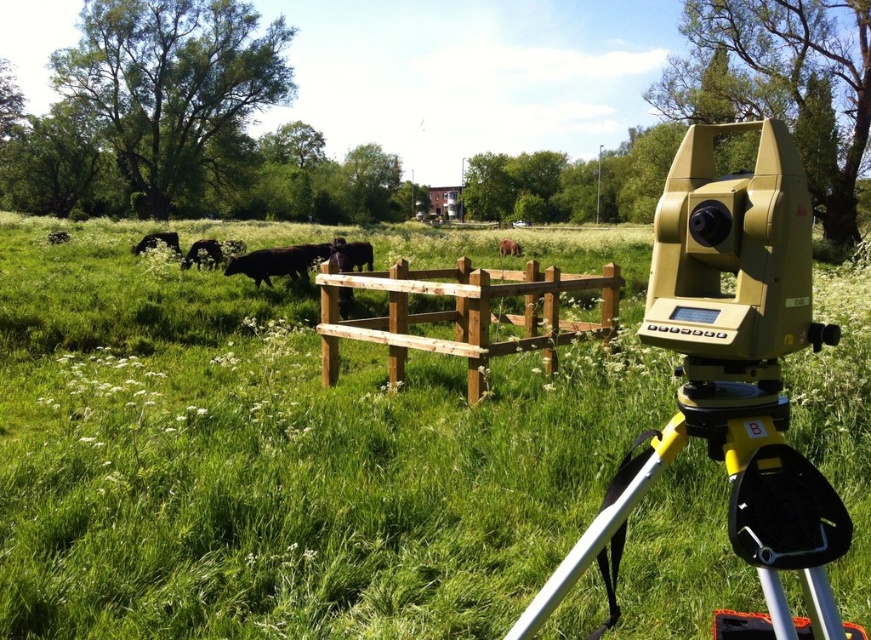
Question: Is yellow plastic tripod at lower right closer to the viewer compared to black glossy cow at center?

Choices:
 (A) yes
 (B) no

Answer: (A)

Question: Is yellow plastic tripod at lower right positioned at the back of black matte cow at center-left?

Choices:
 (A) yes
 (B) no

Answer: (B)

Question: Based on their relative distances, which object is nearer to the yellow plastic tripod at lower right?

Choices:
 (A) green grassy at center
 (B) black smooth cow at center

Answer: (A)

Question: Considering the relative positions of yellow plastic tripod at lower right and black glossy cow at center in the image provided, where is yellow plastic tripod at lower right located with respect to black glossy cow at center?

Choices:
 (A) above
 (B) below

Answer: (B)

Question: Which object is the farthest from the brown furry cow at center?

Choices:
 (A) black matte cow at upper left
 (B) black glossy cow at center

Answer: (A)

Question: Estimate the real-world distances between objects in this image. Which object is closer to the black matte cow at center-left?

Choices:
 (A) yellow plastic tripod at lower right
 (B) black glossy cow at center
 (C) brown wooden fence at center

Answer: (B)